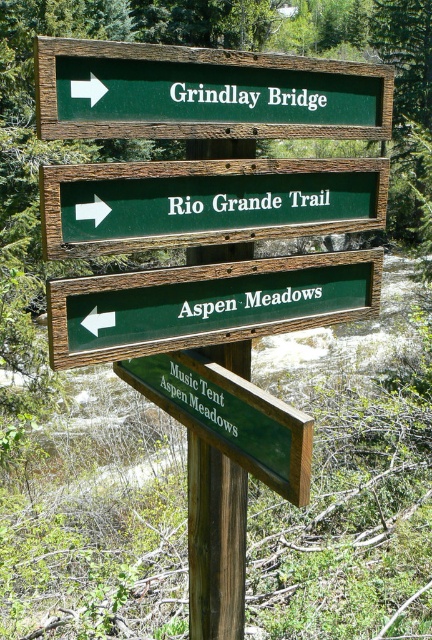
Is green wooden sign at lower left thinner than green wooden sign at lower right?

Incorrect, green wooden sign at lower left's width is not less than green wooden sign at lower right's.

Who is more forward, (x=266, y=324) or (x=177, y=397)?

Positioned in front is point (x=266, y=324).

The width and height of the screenshot is (432, 640). Identify the location of green wooden sign at lower left. (206, 305).

Is green wooden sign at lower left positioned in front of brown wooden signpost at center?

Yes.

Does green wooden sign at lower left appear under brown wooden signpost at center?

Actually, green wooden sign at lower left is above brown wooden signpost at center.

Between point (330, 291) and point (209, 579), which one is positioned behind?

Positioned behind is point (209, 579).

This screenshot has height=640, width=432. Identify the location of green wooden sign at lower left. (206, 305).

Which is behind, point (267, 458) or point (219, 563)?

The point (219, 563) is behind.

Can you confirm if green wooden sign at lower right is thinner than brown wooden signpost at center?

Incorrect, green wooden sign at lower right's width is not less than brown wooden signpost at center's.

Is point (229, 451) positioned behind point (241, 545)?

No, (229, 451) is closer to viewer.

Find the location of a particular element. This screenshot has height=640, width=432. green wooden sign at lower right is located at coordinates (229, 417).